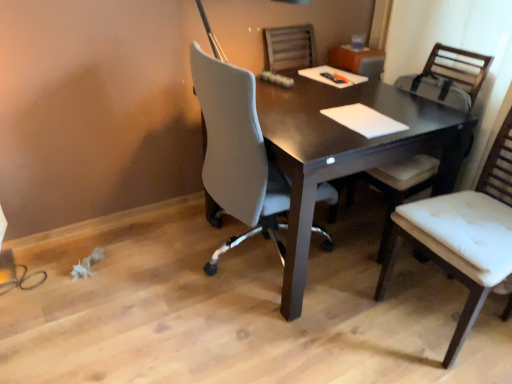
This screenshot has height=384, width=512. I want to click on free area in between dark wood desk at center and white leather chair at right, arranged as the second chair when viewed from the back, so click(x=373, y=323).